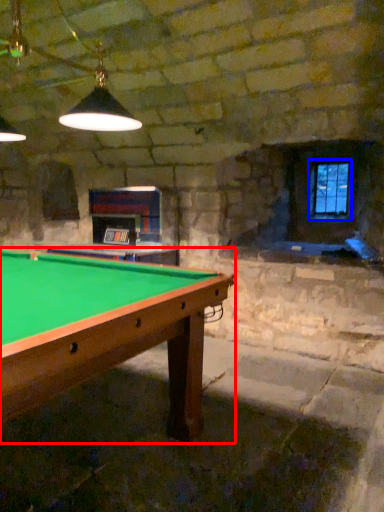
Question: Which object appears closest to the camera in this image, billiard table (highlighted by a red box) or window (highlighted by a blue box)?

Choices:
 (A) billiard table
 (B) window

Answer: (A)